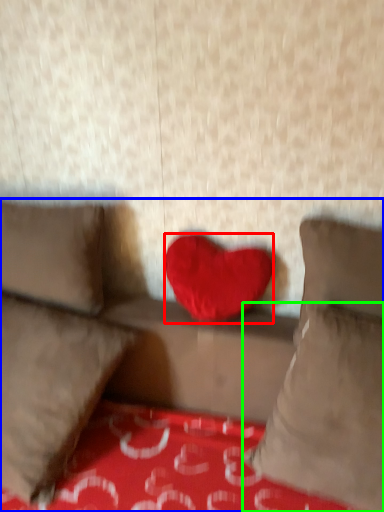
Question: Which is farther away from heart (highlighted by a red box)? studio couch (highlighted by a blue box) or pillow (highlighted by a green box)?

Choices:
 (A) studio couch
 (B) pillow

Answer: (B)